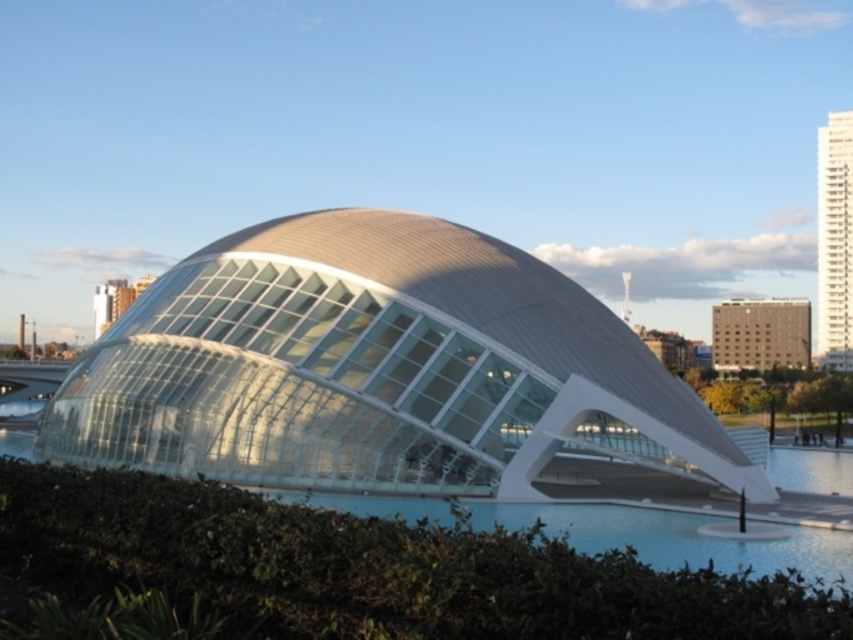
You are standing at the entrance of the modern building and see the point marked at coordinates point (373, 568). What is located at that point?

The point (373, 568) marks the green leafy hedge at lower center.

You are a landscape architect planning to place a 3m wide decorative fountain between the green leafy hedge at lower center and the white glass building at upper right. Based on their widths, can the fountain fit between them without overlapping either?

The green leafy hedge at lower center might be wider than the white glass building at upper right, but since the exact width difference isn not specified, we cannot confirm if the 3m wide fountain would fit without overlapping. More information is needed about their actual widths.

You are standing in front of the modern architectural structure and want to take a photo that includes both the white glass dome at center and the green leafy hedge at lower center. Based on their positions, which object should you place on the left side of your camera frame to include both in the shot?

The white glass dome at center is positioned on the left side of green leafy hedge at lower center, so to include both in the shot, you should place the white glass dome at center on the left side of your camera frame and the green leafy hedge at lower center on the right side.